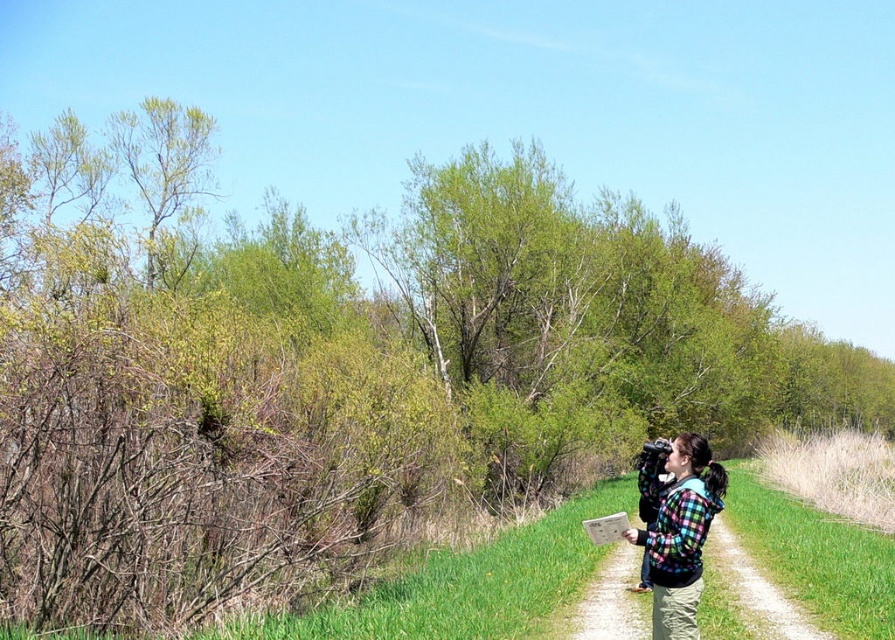
Question: Is green grass at lower center positioned in front of plaid fleece jacket at right?

Choices:
 (A) no
 (B) yes

Answer: (A)

Question: Does green grass at lower center appear on the right side of plaid fleece jacket at right?

Choices:
 (A) yes
 (B) no

Answer: (A)

Question: Does green grass at lower center have a smaller size compared to plaid fleece jacket at right?

Choices:
 (A) no
 (B) yes

Answer: (A)

Question: Which of the following is the closest to the observer?

Choices:
 (A) (659, 513)
 (B) (371, 611)

Answer: (A)